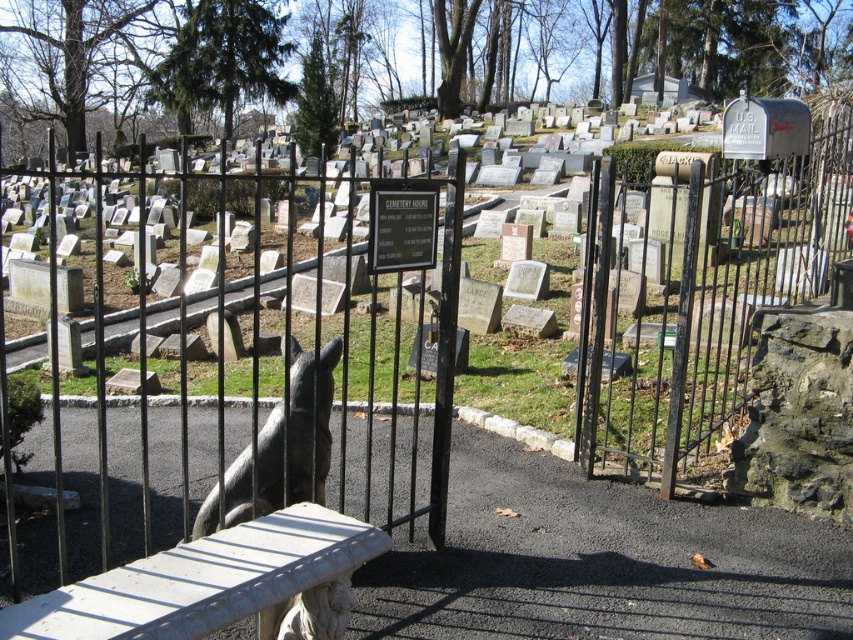
Question: Is black wrought iron gate at center above rusty metal gate at right?

Choices:
 (A) yes
 (B) no

Answer: (A)

Question: Is rusty metal gate at right to the right of shiny black statue at center from the viewer's perspective?

Choices:
 (A) yes
 (B) no

Answer: (A)

Question: Which object appears closest to the camera in this image?

Choices:
 (A) rusty metal gate at right
 (B) shiny black statue at center
 (C) black wrought iron gate at center

Answer: (C)

Question: Is black wrought iron gate at center in front of shiny black statue at center?

Choices:
 (A) no
 (B) yes

Answer: (B)

Question: Which point is farther to the camera?

Choices:
 (A) (x=239, y=468)
 (B) (x=722, y=304)

Answer: (B)

Question: Among these objects, which one is farthest from the camera?

Choices:
 (A) rusty metal gate at right
 (B) black wrought iron gate at center

Answer: (A)